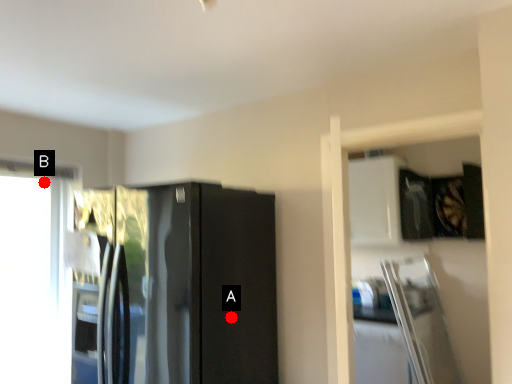
Question: Two points are circled on the image, labeled by A and B beside each circle. Which point is closer to the camera?

Choices:
 (A) A is closer
 (B) B is closer

Answer: (A)